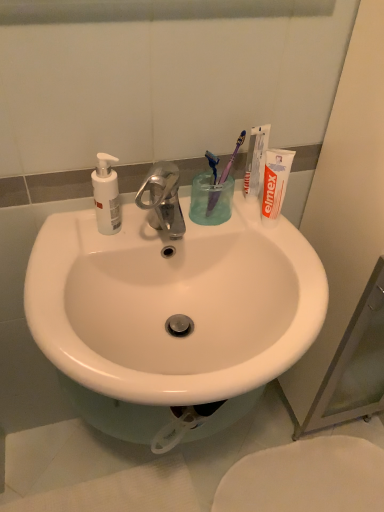
Question: Which direction should I rotate to look at purple plastic toothbrush at upper center, which appears as the first toothbrush when viewed from the left?

Choices:
 (A) right
 (B) left

Answer: (A)

Question: Can you see transparent plastic cup at center touching white matte toothpaste at upper right?

Choices:
 (A) no
 (B) yes

Answer: (B)

Question: From the image's perspective, would you say transparent plastic cup at center is positioned over white matte toothpaste at upper right?

Choices:
 (A) no
 (B) yes

Answer: (A)

Question: Is transparent plastic cup at center to the left of white matte toothpaste at upper right from the viewer's perspective?

Choices:
 (A) yes
 (B) no

Answer: (A)

Question: Does transparent plastic cup at center have a lesser width compared to white matte toothpaste at upper right?

Choices:
 (A) no
 (B) yes

Answer: (A)

Question: Does transparent plastic cup at center have a greater width compared to white matte toothpaste at upper right?

Choices:
 (A) no
 (B) yes

Answer: (B)

Question: Is transparent plastic cup at center far from white matte toothpaste at upper right?

Choices:
 (A) yes
 (B) no

Answer: (B)

Question: Is white glossy toilet at lower right shorter than purple plastic toothbrush at upper right, the 1th toothbrush in the right-to-left sequence?

Choices:
 (A) yes
 (B) no

Answer: (A)

Question: Is purple plastic toothbrush at upper right, arranged as the second toothbrush when viewed from the left, at the back of white glossy toilet at lower right?

Choices:
 (A) no
 (B) yes

Answer: (A)

Question: Is white glossy toilet at lower right at the right side of purple plastic toothbrush at upper right, the 1th toothbrush in the right-to-left sequence?

Choices:
 (A) yes
 (B) no

Answer: (A)

Question: Is purple plastic toothbrush at upper right, the 1th toothbrush in the right-to-left sequence, surrounded by white glossy toilet at lower right?

Choices:
 (A) yes
 (B) no

Answer: (B)

Question: From a real-world perspective, is white glossy toilet at lower right positioned under purple plastic toothbrush at upper right, arranged as the second toothbrush when viewed from the left, based on gravity?

Choices:
 (A) no
 (B) yes

Answer: (B)

Question: Does white glossy toilet at lower right have a greater width compared to purple plastic toothbrush at upper right, arranged as the second toothbrush when viewed from the left?

Choices:
 (A) yes
 (B) no

Answer: (A)

Question: Can you confirm if white matte soap dispenser at left is bigger than white glossy sink at center?

Choices:
 (A) yes
 (B) no

Answer: (B)